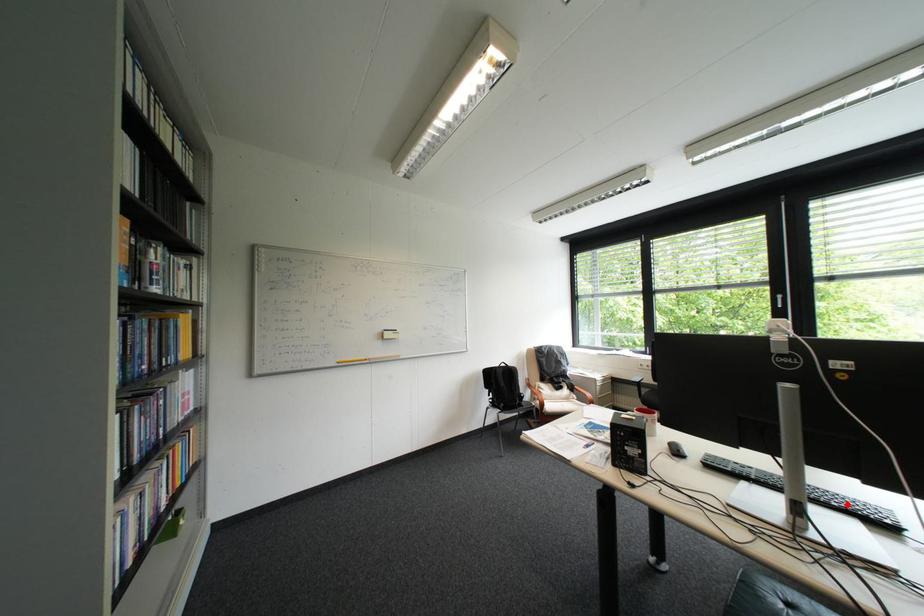
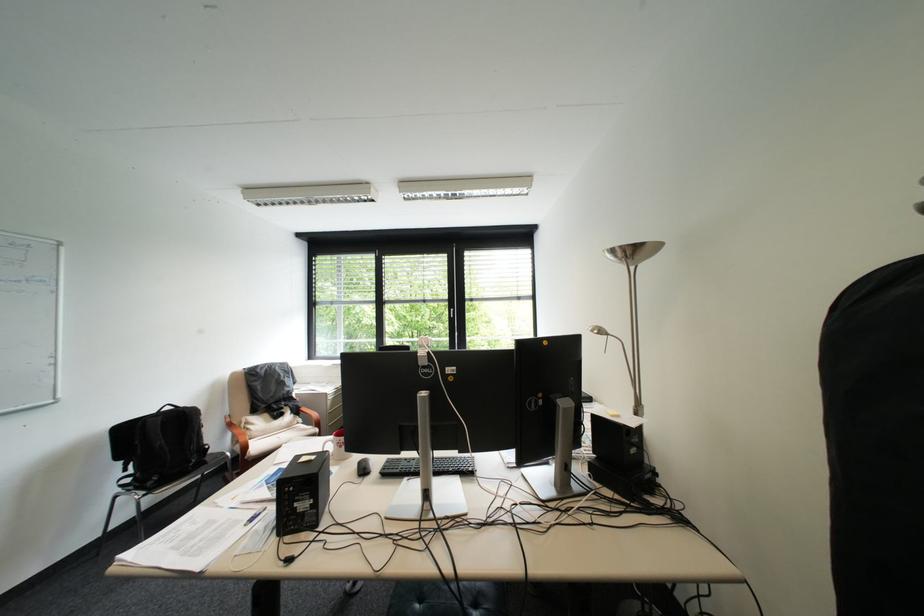
Question: A red point is marked in image1. In image2, is the corresponding 3D point closer to the camera or farther? Reply with the corresponding letter.

Choices:
 (A) The corresponding 3D point is closer.
 (B) The corresponding 3D point is farther.

Answer: (B)